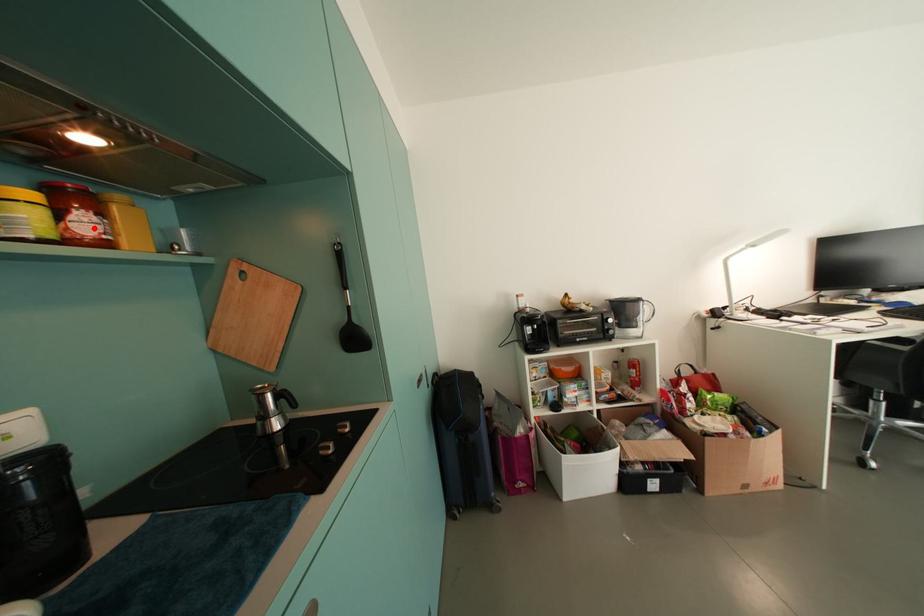
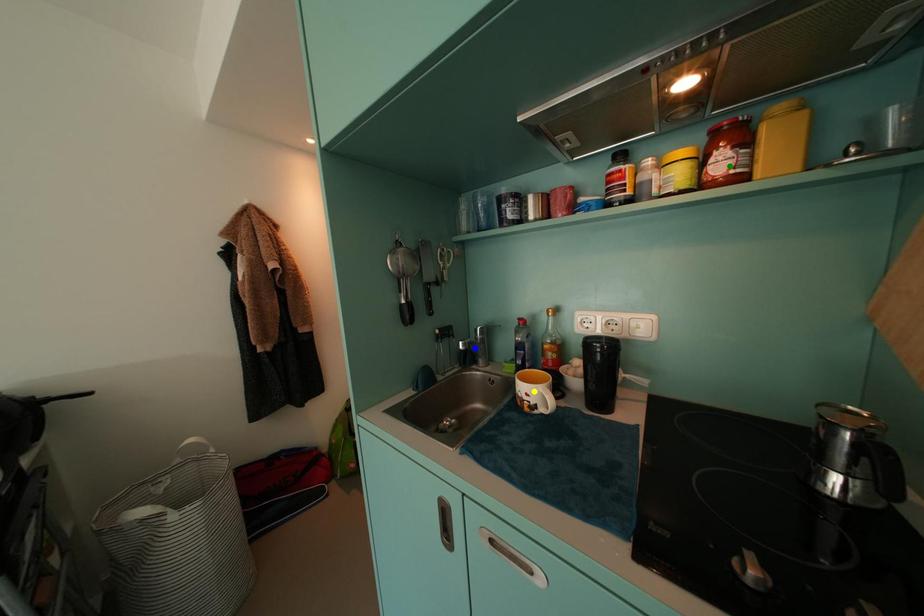
Question: I am providing you with two images of the same scene from different viewpoints. A red point is marked on the first image. You are given multiple points on the second image. Which point in image 2 is actually the same real-world point as the red point in image 1?

Choices:
 (A) green point
 (B) yellow point
 (C) blue point

Answer: (A)